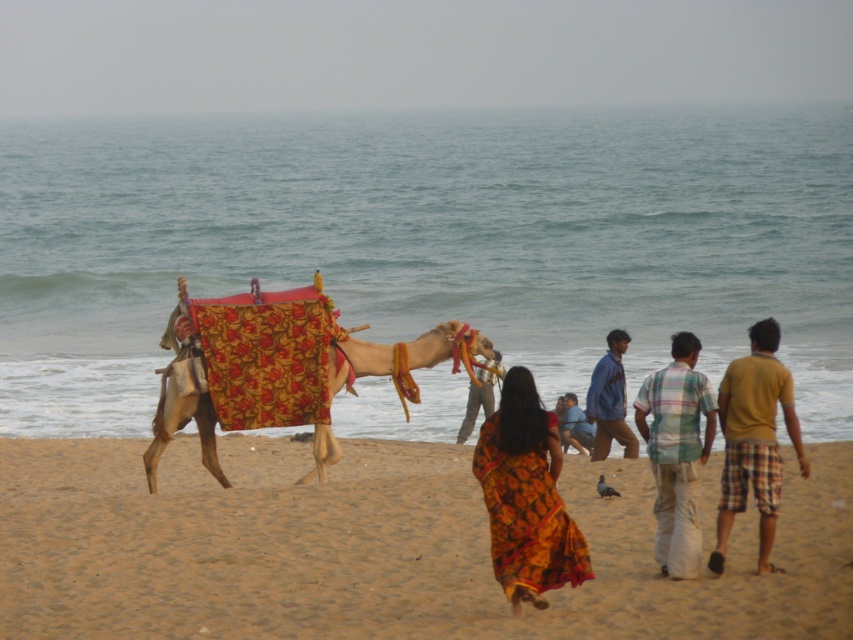
Question: Which object appears farthest from the camera in this image?

Choices:
 (A) blue denim shirt at center
 (B) blue plaid shirt at center
 (C) plaid cotton shirt at center right

Answer: (B)

Question: Is yellow plaid shorts at right smaller than plaid cotton shirt at center right?

Choices:
 (A) yes
 (B) no

Answer: (A)

Question: In this image, where is floral fabric camel at center located relative to blue plaid shirt at center?

Choices:
 (A) right
 (B) left

Answer: (B)

Question: Considering the real-world distances, which object is closest to the plaid cotton shirt at center right?

Choices:
 (A) floral fabric camel at center
 (B) beige sand at lower center

Answer: (B)

Question: Which of the following is the closest to the observer?

Choices:
 (A) plaid cotton shirt at center right
 (B) blue denim shirt at center

Answer: (A)

Question: Can you confirm if printed cotton sari at center is positioned to the left of yellow plaid shorts at right?

Choices:
 (A) yes
 (B) no

Answer: (A)